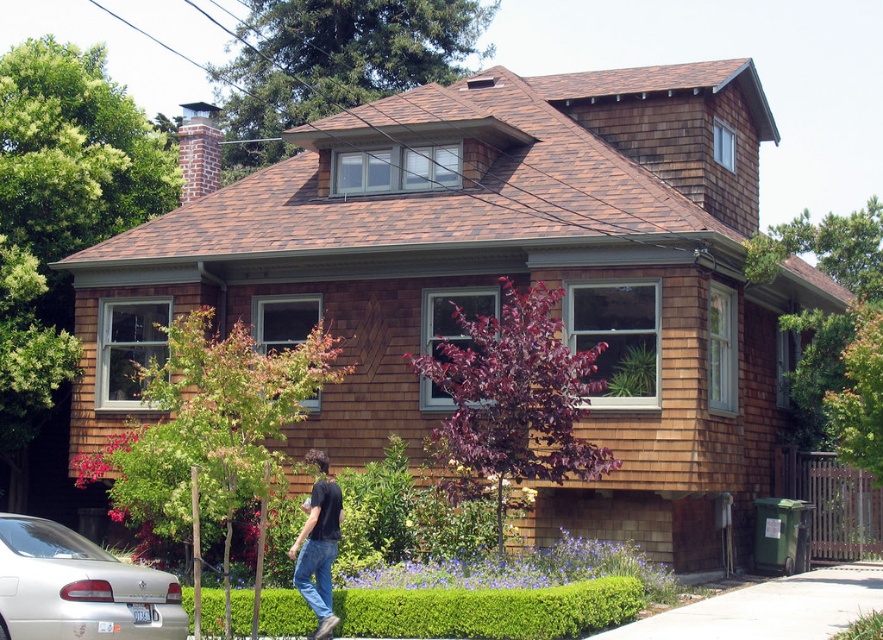
Question: Is concrete at lower right smaller than black cotton shirt at lower center?

Choices:
 (A) yes
 (B) no

Answer: (B)

Question: Considering the real-world distances, which object is closest to the black cotton shirt at lower center?

Choices:
 (A) concrete at lower right
 (B) silver metallic car at lower left

Answer: (B)

Question: Does silver metallic car at lower left have a lesser width compared to concrete at lower right?

Choices:
 (A) yes
 (B) no

Answer: (A)

Question: Among these points, which one is nearest to the camera?

Choices:
 (A) (21, 577)
 (B) (696, 614)
 (C) (338, 497)
 (D) (232, 634)

Answer: (A)

Question: Which object appears farthest from the camera in this image?

Choices:
 (A) silver metallic car at lower left
 (B) green leafy hedge at lower center

Answer: (B)

Question: Is green leafy hedge at lower center positioned behind silver metallic car at lower left?

Choices:
 (A) yes
 (B) no

Answer: (A)